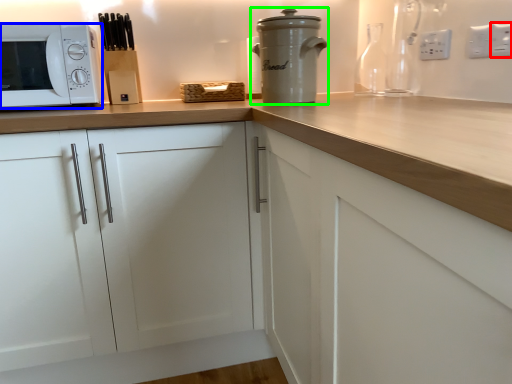
Question: Based on their relative distances, which object is farther from electric outlet (highlighted by a red box)? Choose from microwave oven (highlighted by a blue box) and home appliance (highlighted by a green box).

Choices:
 (A) microwave oven
 (B) home appliance

Answer: (A)